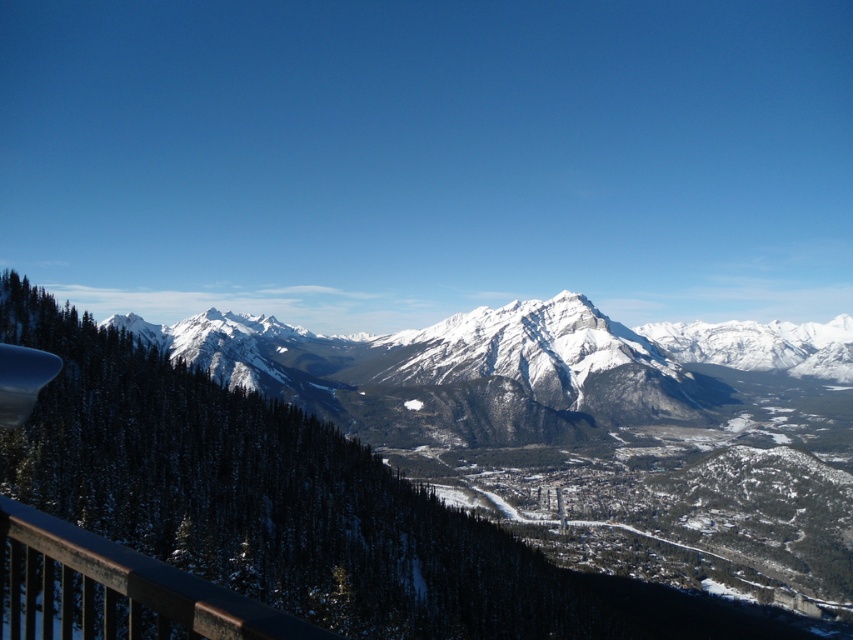
Question: Does snowy rocky mountain at center have a smaller size compared to dark brown wooden rail at lower left?

Choices:
 (A) no
 (B) yes

Answer: (A)

Question: Which point is farther from the camera taking this photo?

Choices:
 (A) (154, 588)
 (B) (511, 346)

Answer: (B)

Question: Which of these objects is positioned closest to the white snow-covered mountain range at center?

Choices:
 (A) snowy rocky mountain at center
 (B) dark brown wooden rail at lower left

Answer: (A)

Question: Does white snow-covered mountain range at center have a smaller size compared to dark brown wooden rail at lower left?

Choices:
 (A) yes
 (B) no

Answer: (B)

Question: Which point appears farthest from the camera in this image?

Choices:
 (A) pyautogui.click(x=355, y=368)
 (B) pyautogui.click(x=44, y=564)

Answer: (A)

Question: Can you confirm if snowy rocky mountain at center is positioned to the left of dark brown wooden rail at lower left?

Choices:
 (A) yes
 (B) no

Answer: (B)